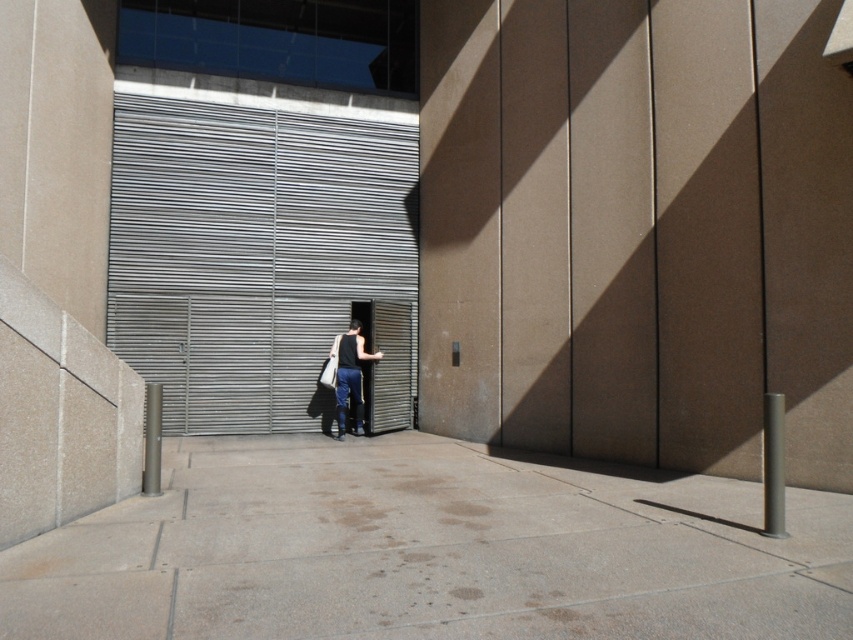
Question: Can you confirm if metallic gray garage door at center is thinner than white fabric shopping bag at center?

Choices:
 (A) yes
 (B) no

Answer: (B)

Question: Which point appears farthest from the camera in this image?

Choices:
 (A) (715, 516)
 (B) (230, 148)
 (C) (331, 355)
 (D) (337, 368)

Answer: (B)

Question: Which point is farther to the camera?

Choices:
 (A) (346, 337)
 (B) (239, 573)
 (C) (328, 364)

Answer: (C)

Question: Is dark gray jeans at center to the left of white fabric shopping bag at center from the viewer's perspective?

Choices:
 (A) no
 (B) yes

Answer: (A)

Question: Is dark gray jeans at center wider than white fabric shopping bag at center?

Choices:
 (A) yes
 (B) no

Answer: (A)

Question: Which point is farther to the camera?

Choices:
 (A) (354, 332)
 (B) (167, 618)
 (C) (288, 349)
 (D) (329, 362)

Answer: (C)